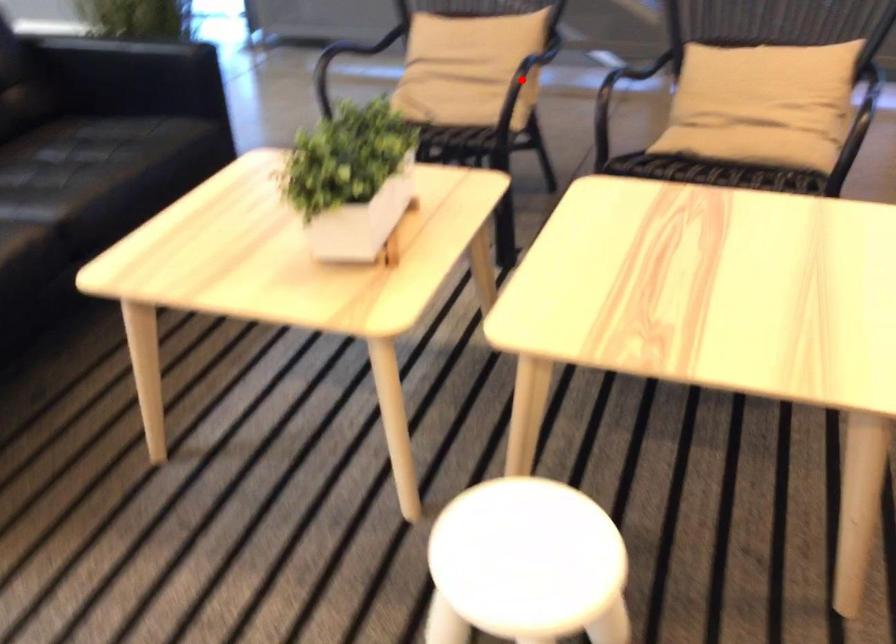
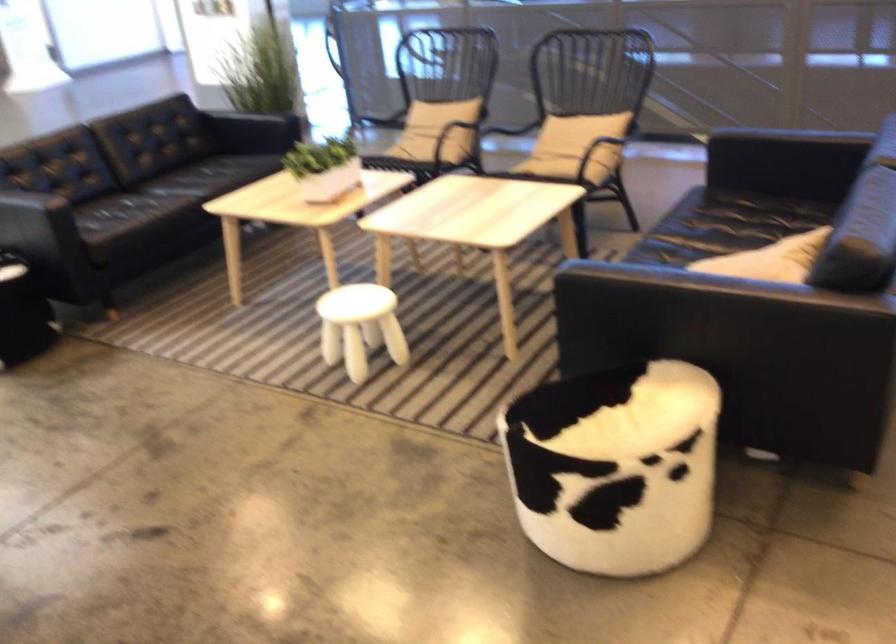
Where in the second image is the point corresponding to the highlighted location from the first image?

(440, 128)